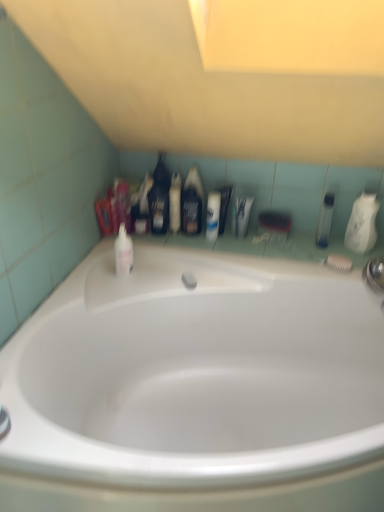
Question: Does point (130, 243) appear closer or farther from the camera than point (198, 231)?

Choices:
 (A) closer
 (B) farther

Answer: (A)

Question: From their relative heights in the image, would you say pink glossy mouthwash at upper left, acting as the fifth mouthwash starting from the right, is taller or shorter than black matte bottle at center, positioned as the third mouthwash in left-to-right order?

Choices:
 (A) tall
 (B) short

Answer: (B)

Question: Estimate the real-world distances between objects in this image. Which object is farther from the white glossy mouthwash at upper right, positioned as the first mouthwash in right-to-left order?

Choices:
 (A) clear plastic bottle at right, which is counted as the 2th mouthwash, starting from the right
 (B) translucent plastic mouthwash at upper center, which ranks as the fourth mouthwash in right-to-left order
 (C) white glossy bathtub at center
 (D) black matte bottle at center, positioned as the third mouthwash in left-to-right order
 (E) black plastic bottle at center, which is the 1th toiletry from left to right

Answer: (E)

Question: Estimate the real-world distances between objects in this image. Which object is closer to the white glossy mouthwash at upper right, positioned as the first mouthwash in right-to-left order?

Choices:
 (A) pink glossy mouthwash at upper left, which is counted as the 1th mouthwash, starting from the left
 (B) white glossy lotion at center, which is the 2th toiletry in left-to-right order
 (C) black plastic bottle at center, which is the 1th toiletry from left to right
 (D) white glossy toothpaste tube at center, the 1th toiletry from the right
 (E) translucent plastic mouthwash at upper center, which ranks as the fourth mouthwash in right-to-left order

Answer: (D)